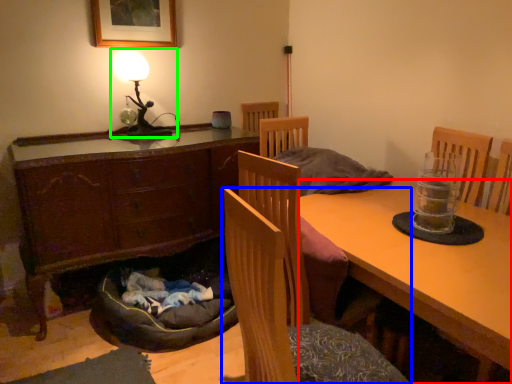
Question: Which object is positioned farthest from desk (highlighted by a red box)? Select from chair (highlighted by a blue box) and table lamp (highlighted by a green box).

Choices:
 (A) chair
 (B) table lamp

Answer: (B)